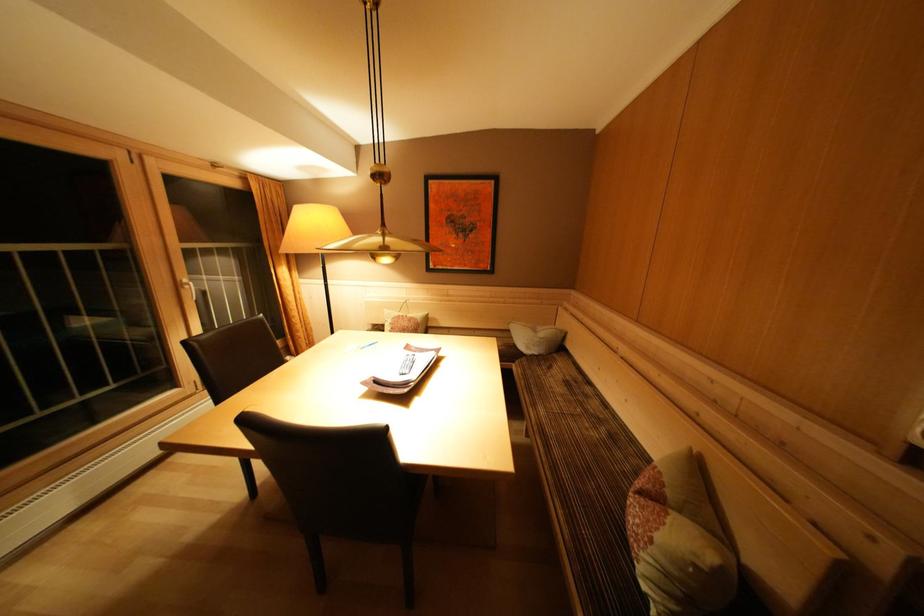
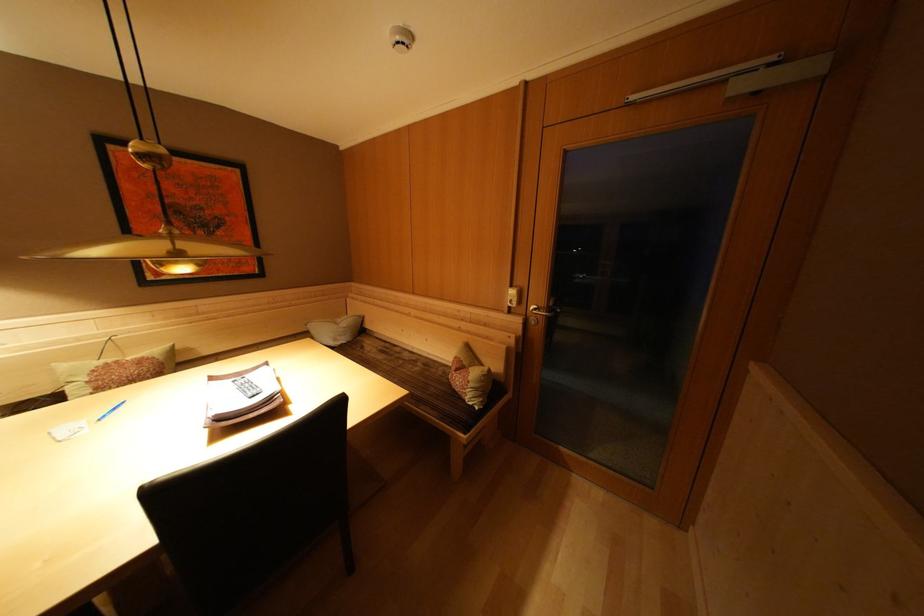
Question: The camera is either moving clockwise (left) or counter-clockwise (right) around the object. The first image is from the beginning of the video and the second image is from the end. Is the camera moving left or right when shooting the video?

Choices:
 (A) Left
 (B) Right

Answer: (A)